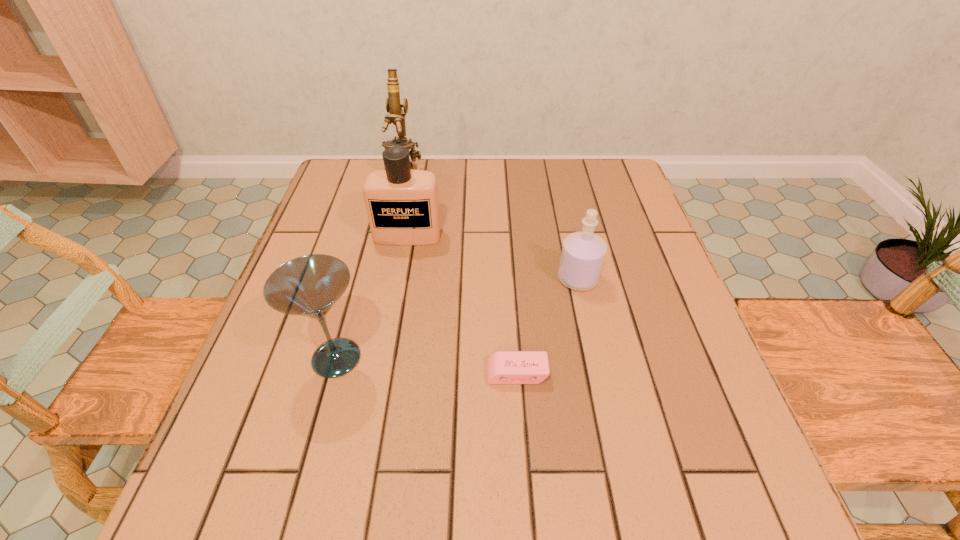
Find the location of a particular element. The height and width of the screenshot is (540, 960). free space located 0.180m on the front label of the taller perfume is located at coordinates (396, 302).

Where is `vacant space located 0.210m on the front of the martini`? vacant space located 0.210m on the front of the martini is located at coordinates (293, 519).

Identify the location of vacant space situated 0.080m on the back of the nearer perfume. (570, 242).

Image resolution: width=960 pixels, height=540 pixels. I want to click on vacant space situated 0.270m on the left of the fourth object from left to right, so click(339, 373).

Locate an element on the screen. object at the far edge is located at coordinates (397, 116).

Locate an element on the screen. The height and width of the screenshot is (540, 960). microscope present at the left edge is located at coordinates (397, 116).

Where is `martini that is at the left edge`? This screenshot has width=960, height=540. martini that is at the left edge is located at coordinates click(x=309, y=286).

The image size is (960, 540). What are the coordinates of `object located in the far left corner section of the desktop` in the screenshot? It's located at (397, 116).

You are a GUI agent. You are given a task and a screenshot of the screen. Output one action in this format:
    pyautogui.click(x=<x>, y=<y>)
    Task: Click on the vacant space at the far edge of the desktop
    The image size is (960, 540).
    Given the screenshot: What is the action you would take?
    pyautogui.click(x=421, y=170)

You are a GUI agent. You are given a task and a screenshot of the screen. Output one action in this format:
    pyautogui.click(x=<x>, y=<y>)
    Task: Click on the vacant space at the near edge of the desktop
    Image resolution: width=960 pixels, height=540 pixels.
    Given the screenshot: What is the action you would take?
    [x=628, y=504]